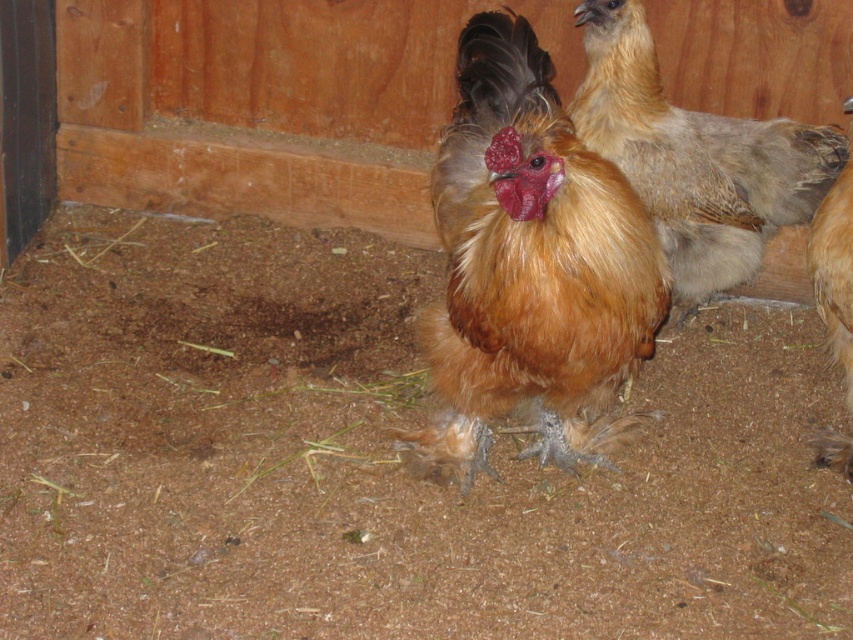
You are a farmer checking the coop. You notice two birds at the center of the coop, a golden brown feathered rooster at center and a golden feathered chicken at center. Which one is positioned lower in the scene?

The golden brown feathered rooster at center is located below the golden feathered chicken at center, so it is positioned lower in the scene.

Consider the image. You are a farmer checking the coop. You notice two birds at the center. Which one is closer to you, the golden brown feathered rooster at center or the golden feathered chicken at center?

The golden brown feathered rooster at center is closer to you because it is in front of the golden feathered chicken at center.